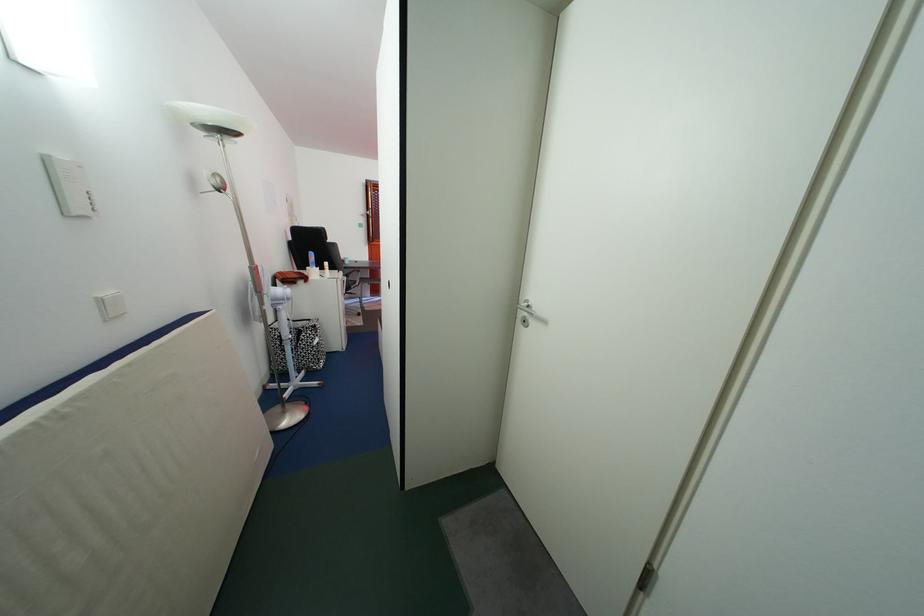
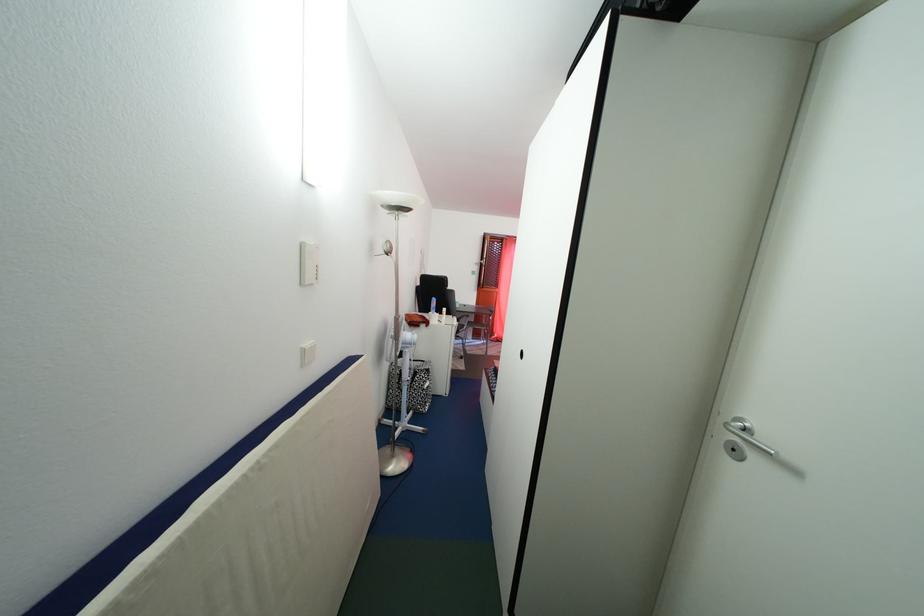
Where in the second image is the point corresponding to [355,283] from the first image?

(467, 328)